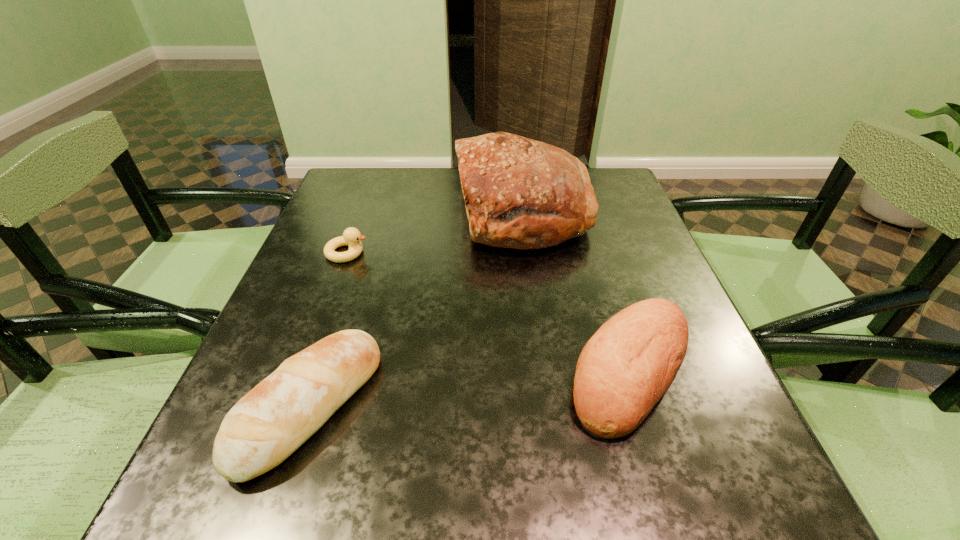
Identify the location of the tallest bread. (520, 193).

Image resolution: width=960 pixels, height=540 pixels. Find the location of `the tallest object`. the tallest object is located at coordinates (520, 193).

This screenshot has width=960, height=540. I want to click on the leftmost bread, so click(x=277, y=416).

Locate an element on the screen. The height and width of the screenshot is (540, 960). the shortest object is located at coordinates (351, 237).

The height and width of the screenshot is (540, 960). In order to click on blank space located 0.080m at the sliced front of the farthest bread in this screenshot , I will do `click(424, 212)`.

Locate an element on the screen. vacant space located at the sliced front of the farthest bread is located at coordinates (322, 212).

Identify the location of vacant space located 0.070m at the sliced front of the farthest bread. The height and width of the screenshot is (540, 960). (428, 212).

In order to click on free space located 0.400m on the right of the leftmost bread in this screenshot , I will do `click(627, 406)`.

Locate an element on the screen. vacant space situated at the beak of the duckling is located at coordinates (484, 253).

I want to click on object that is positioned at the far edge, so [520, 193].